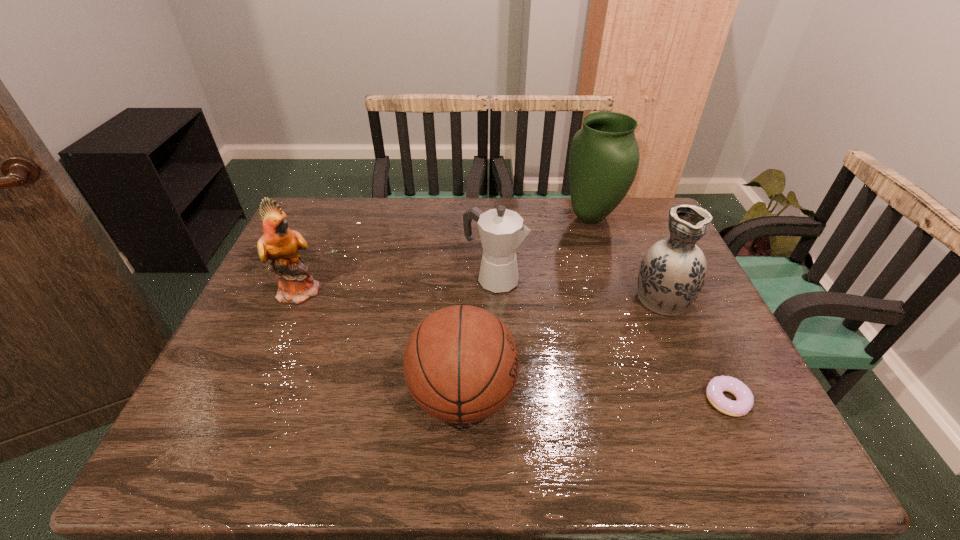
Find the location of a particular element. The width and height of the screenshot is (960, 540). free space located 0.150m with the handle on the side of the nearer vase is located at coordinates (637, 244).

In order to click on vacant space located 0.250m with the handle on the side of the nearer vase in this screenshot , I will do `click(630, 225)`.

Where is `free region located 0.110m on the back of the coffeepot`? free region located 0.110m on the back of the coffeepot is located at coordinates (493, 244).

At what (x,y) coordinates should I click in order to perform the action: click on free region located 0.290m on the side with brand label of the basketball. Please return your answer as a coordinate pair (x, y). The height and width of the screenshot is (540, 960). Looking at the image, I should click on (648, 396).

At what (x,y) coordinates should I click in order to perform the action: click on vacant space located 0.300m on the left of the shortest object. Please return your answer as a coordinate pair (x, y). This screenshot has height=540, width=960. Looking at the image, I should click on (567, 400).

Where is `object at the far edge`? object at the far edge is located at coordinates (604, 155).

In order to click on object present at the near edge in this screenshot , I will do `click(461, 364)`.

Find the location of a particular element. The height and width of the screenshot is (540, 960). object that is at the left edge is located at coordinates (280, 244).

Where is `doughnut present at the right edge`? This screenshot has height=540, width=960. doughnut present at the right edge is located at coordinates (744, 402).

This screenshot has height=540, width=960. What are the coordinates of `object that is at the far right corner` in the screenshot? It's located at (604, 155).